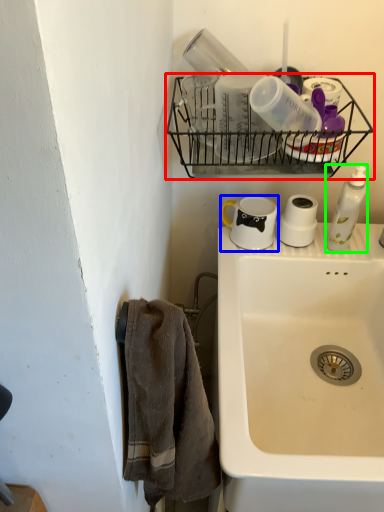
Question: Based on their relative distances, which object is nearer to shelf (highlighted by a red box)? Choose from coffee cup (highlighted by a blue box) and soap dispenser (highlighted by a green box).

Choices:
 (A) coffee cup
 (B) soap dispenser

Answer: (A)